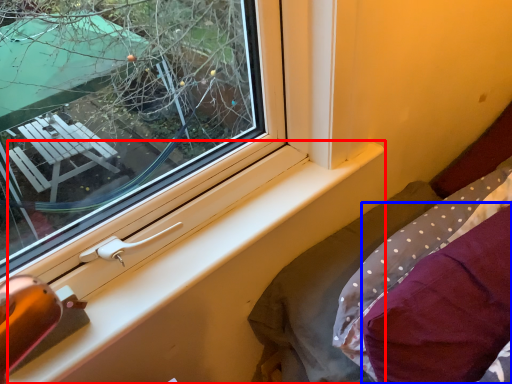
Question: Which point is closer to the camera, window sill (highlighted by a red box) or pillow (highlighted by a blue box)?

Choices:
 (A) window sill
 (B) pillow

Answer: (B)